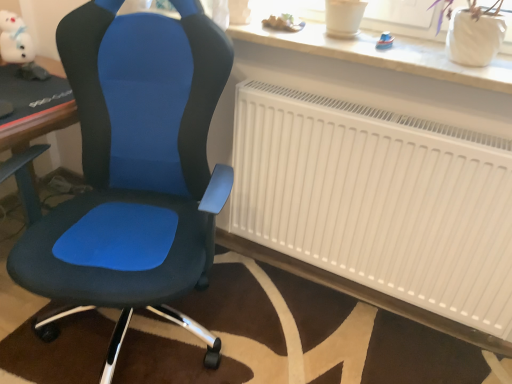
In order to click on free point below white matte radiator at center (from a real-world perspective) in this screenshot , I will do `click(345, 296)`.